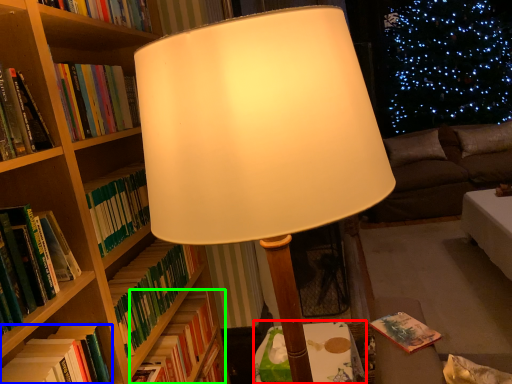
Question: Which object is the closest to the table (highlighted by a red box)? Choose among these: book (highlighted by a blue box) or book (highlighted by a green box).

Choices:
 (A) book
 (B) book

Answer: (B)